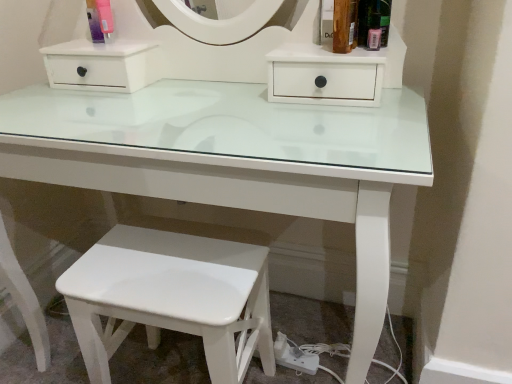
Find the location of `white matte stool at lower left`. white matte stool at lower left is located at coordinates (172, 298).

The image size is (512, 384). What do you see at coordinates (172, 298) in the screenshot? I see `white matte stool at lower left` at bounding box center [172, 298].

This screenshot has height=384, width=512. I want to click on white matte stool at lower left, so click(172, 298).